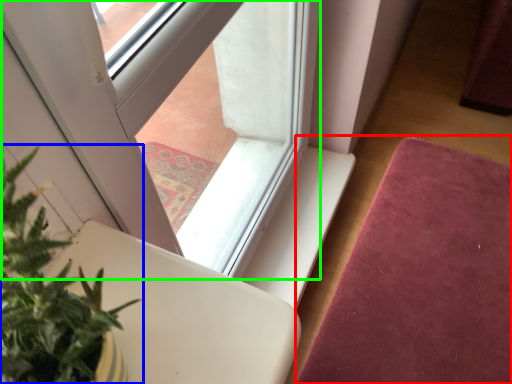
Question: Considering the real-world distances, which object is closest to mat (highlighted by a red box)? houseplant (highlighted by a blue box) or window (highlighted by a green box).

Choices:
 (A) houseplant
 (B) window

Answer: (B)